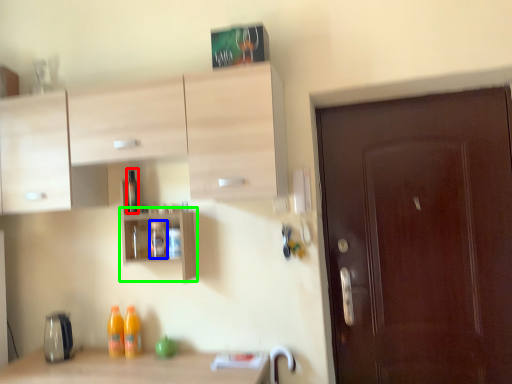
Question: Estimate the real-world distances between objects in this image. Which object is closer to bottle (highlighted by a red box), bottle (highlighted by a blue box) or shelf (highlighted by a green box)?

Choices:
 (A) bottle
 (B) shelf

Answer: (B)